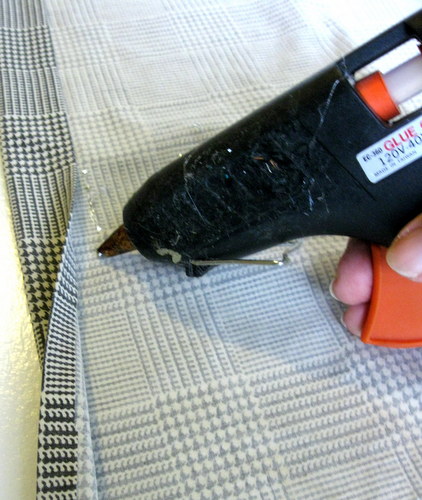
At what (x,y) coordinates should I click in order to perform the action: click on stand. Please return your answer as a coordinate pair (x, y). Image resolution: width=422 pixels, height=500 pixels. Looking at the image, I should click on (264, 271).